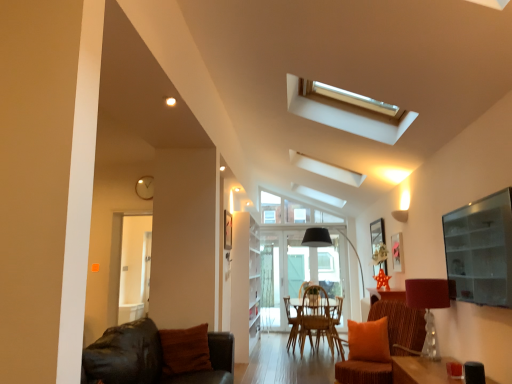
Question: Is translucent glass lampshade at right located within brown woven armchair at center?

Choices:
 (A) yes
 (B) no

Answer: (B)

Question: Considering the relative sizes of brown woven armchair at center and translucent glass lampshade at right in the image provided, is brown woven armchair at center smaller than translucent glass lampshade at right?

Choices:
 (A) no
 (B) yes

Answer: (A)

Question: Considering the relative sizes of brown woven armchair at center and translucent glass lampshade at right in the image provided, is brown woven armchair at center thinner than translucent glass lampshade at right?

Choices:
 (A) yes
 (B) no

Answer: (B)

Question: From the image's perspective, is brown woven armchair at center above translucent glass lampshade at right?

Choices:
 (A) yes
 (B) no

Answer: (B)

Question: Is brown woven armchair at center closer to the viewer compared to translucent glass lampshade at right?

Choices:
 (A) yes
 (B) no

Answer: (B)

Question: Considering the positions of point (123, 314) and point (175, 372), is point (123, 314) closer or farther from the camera than point (175, 372)?

Choices:
 (A) farther
 (B) closer

Answer: (A)

Question: In terms of width, does transparent glass door at left, arranged as the first glass door when viewed from the front, look wider or thinner when compared to brown fuzzy pillow at lower left?

Choices:
 (A) wide
 (B) thin

Answer: (A)

Question: Considering their positions, is transparent glass door at left, positioned as the first glass door in left-to-right order, located in front of or behind brown fuzzy pillow at lower left?

Choices:
 (A) front
 (B) behind

Answer: (B)

Question: From the image's perspective, is transparent glass door at left, the 2th glass door in the right-to-left sequence, located above or below brown fuzzy pillow at lower left?

Choices:
 (A) below
 (B) above

Answer: (B)

Question: From a real-world perspective, is brown fuzzy pillow at lower left above or below translucent glass lampshade at right?

Choices:
 (A) below
 (B) above

Answer: (A)

Question: Is brown fuzzy pillow at lower left to the left or to the right of translucent glass lampshade at right in the image?

Choices:
 (A) right
 (B) left

Answer: (B)

Question: From the image's perspective, is brown fuzzy pillow at lower left located above or below translucent glass lampshade at right?

Choices:
 (A) below
 (B) above

Answer: (A)

Question: Choose the correct answer: Is brown fuzzy pillow at lower left inside translucent glass lampshade at right or outside it?

Choices:
 (A) outside
 (B) inside

Answer: (A)

Question: From the image's perspective, relative to transparent glass door at center, placed as the 2th glass door when sorted from left to right, is transparent glass door at left, arranged as the first glass door when viewed from the front, above or below?

Choices:
 (A) above
 (B) below

Answer: (A)

Question: Considering the relative positions of transparent glass door at left, arranged as the first glass door when viewed from the front, and transparent glass door at center, placed as the 2th glass door when sorted from left to right, in the image provided, is transparent glass door at left, arranged as the first glass door when viewed from the front, to the left or to the right of transparent glass door at center, placed as the 2th glass door when sorted from left to right,?

Choices:
 (A) left
 (B) right

Answer: (A)